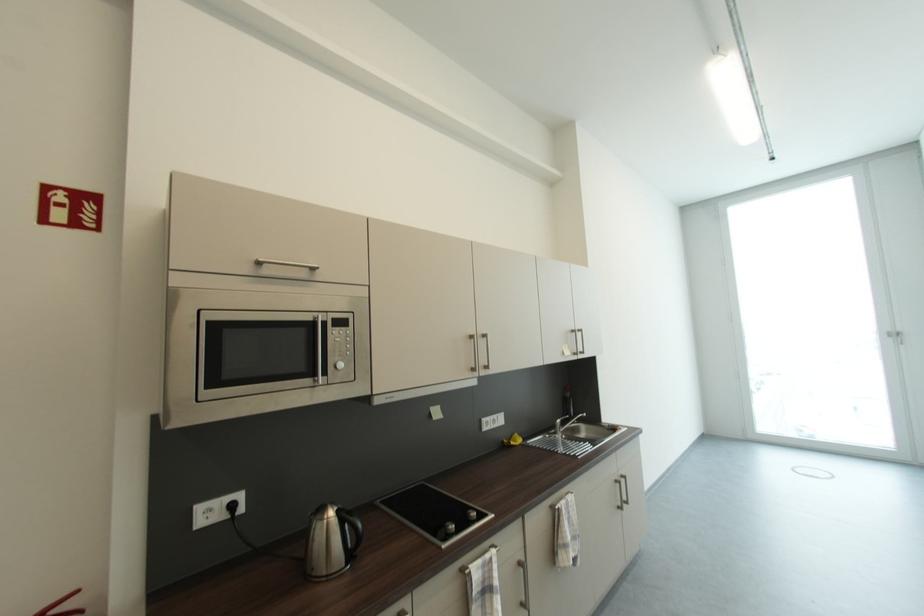
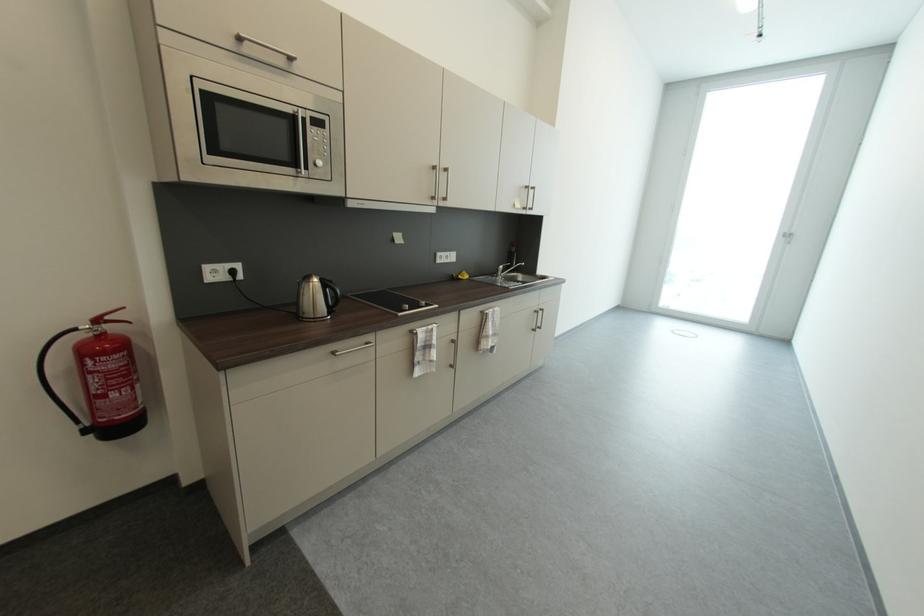
Find the pixel in the second image that matches (517,445) in the first image.

(467, 278)